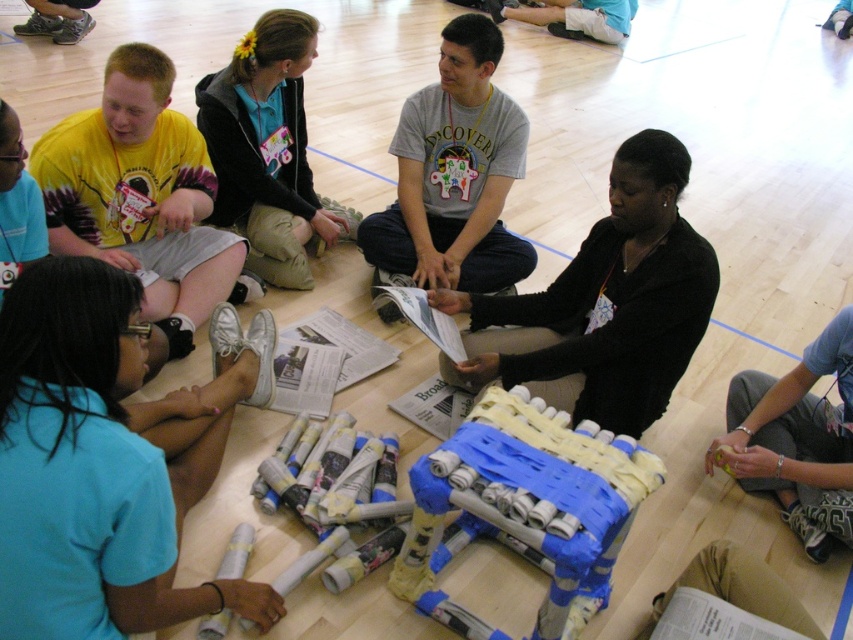
From the picture: You are a photographer standing at the edge of the gymnasium floor. You need to capture a photo that includes both the black hoodie at center and the blue fabric pants at lower right. Given that your camera has a maximum focus range of 5 feet, will you be able to get both subjects in focus without moving your position?

The black hoodie at center is 5.79 feet away from the blue fabric pants at lower right. Since the distance between them exceeds the camera maximum focus range of 5 feet, you won not be able to capture both subjects in focus without moving your position.

You are a photographer trying to capture a candid shot of the group. You notice the black hoodie at center and the blue fabric pants at lower right. Which object should you focus on to ensure it appears larger in your photo?

The black hoodie at center is taller than the blue fabric pants at lower right, so focusing on the black hoodie at center will make it appear larger in the photo.

You are standing at the entrance of the gymnasium and see the black hoodie at center and the blue fabric pants at lower right. Which object is closer to you?

The black hoodie at center is closer to you because it is further to the viewer than the blue fabric pants at lower right.